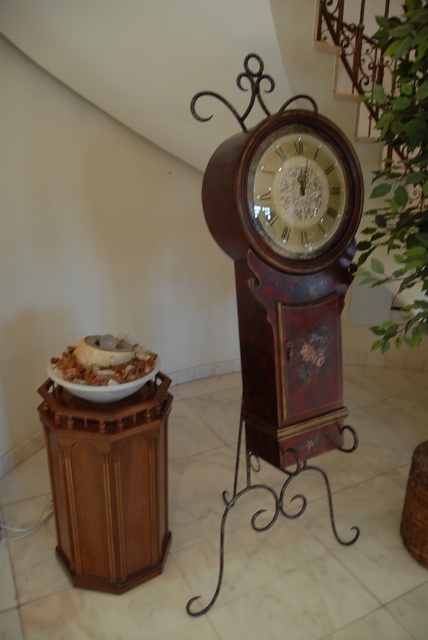
You are arranging a dinner party and need to place a centerpiece on the table. The table has limited space. You have the wooden clock at center and the white matte plate at left available. Which item should you choose to ensure it fits better on the table?

A: The white matte plate at left should be chosen because it is smaller in size than the wooden clock at center, making it more suitable for limited table space.

You are an interior designer planning to hang a picture frame exactly at the center of the wall. The wall is 3 meters wide and 2.5 meters tall. Given the current placement of the shiny brown bowl at lower left, will the picture frame interfere with the bowl?

The shiny brown bowl at lower left is located at point [104,362]. The center of the wall would be at [214,320] in normalized coordinates. Since the bowl is closer to the lower left corner, the picture frame at the center won not interfere with it.

You are setting up a small table in the corner of this room and need to place both the shiny brown bowl at lower left and the white matte plate at left on it. The table has a surface area of 30 square centimeters. Can both items fit on the table without overlapping?

The shiny brown bowl at lower left and white matte plate at left are 5.34 centimeters apart from each other. Since the table has a surface area of 30 square centimeters, which is approximately 5.477 centimeters on each side, the items can fit on the table without overlapping as their combined width is less than the table length.